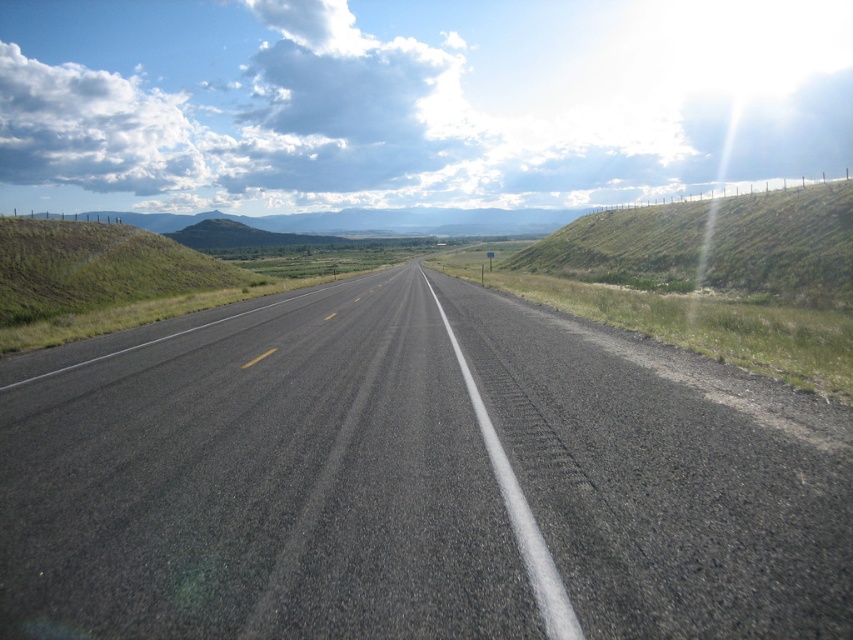
You are driving a car and need to park on the side of the road. Which area would you choose to park in, the black asphalt road at center or the green grassy hillside at left, and why?

You should park on the black asphalt road at center because it is smaller than the green grassy hillside at left, making it more suitable for parking without taking up too much space.

You are driving a car and need to park on the side of the road. The parking spot must be on one of the green grassy hillside at right or green grassy hillside at left. Which side has a larger area for parking?

The green grassy hillside at right is bigger than the green grassy hillside at left, so the parking spot on the green grassy hillside at right has a larger area for parking.

Looking at this image, you are standing at the edge of the road and see two points marked on the road. The first point is at coordinates point (x=782, y=420) and the second is at point (x=653, y=276). Which point is closer to your current position?

Point (x=782, y=420) is closer to the camera than point (x=653, y=276), so the first point is closer to your current position.